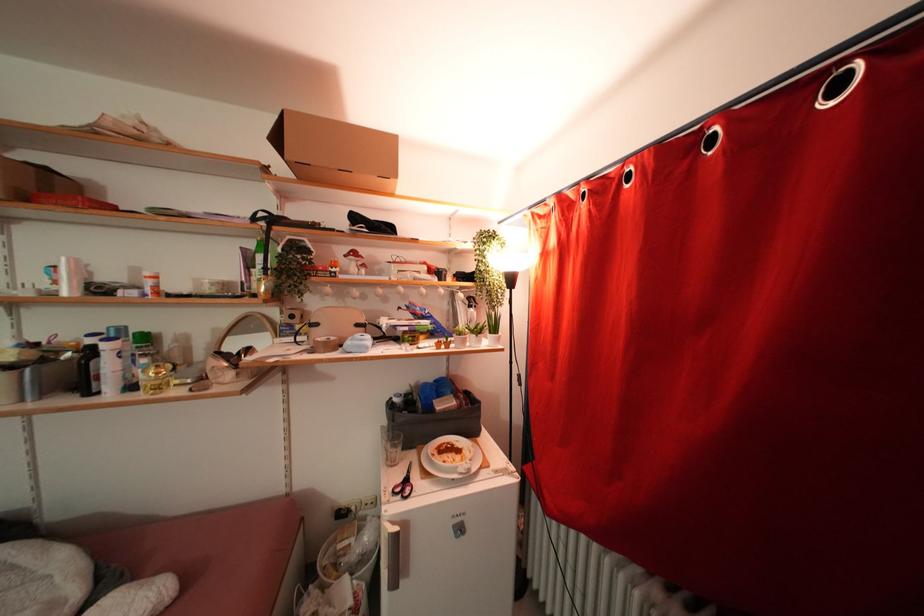
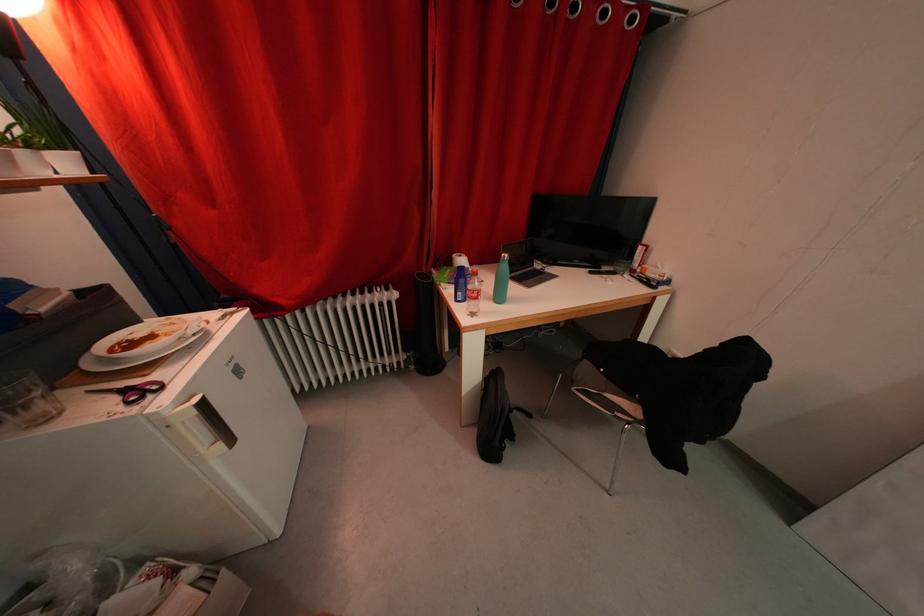
The images are taken continuously from a first-person perspective. In which direction is your viewpoint rotating?

The rotation direction of the camera is right-down.